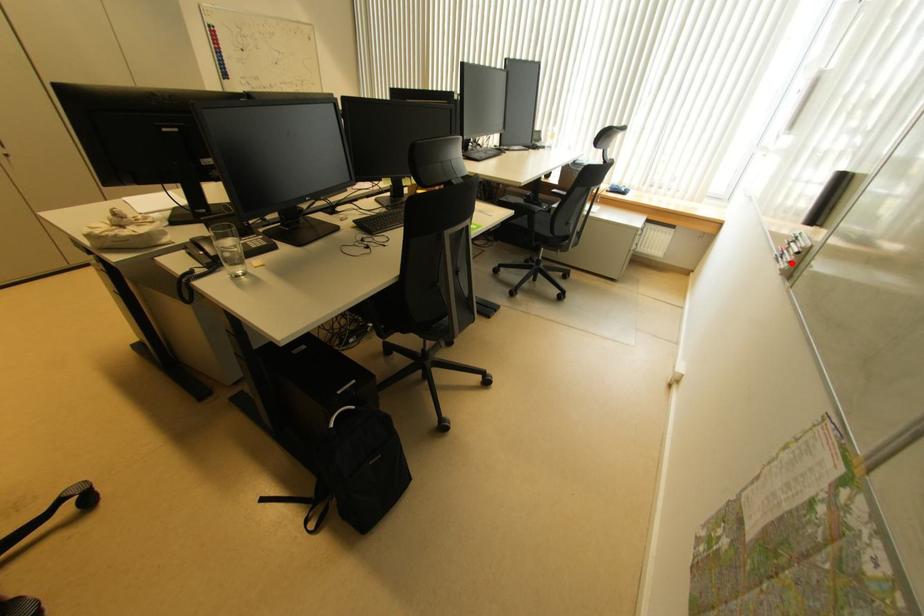
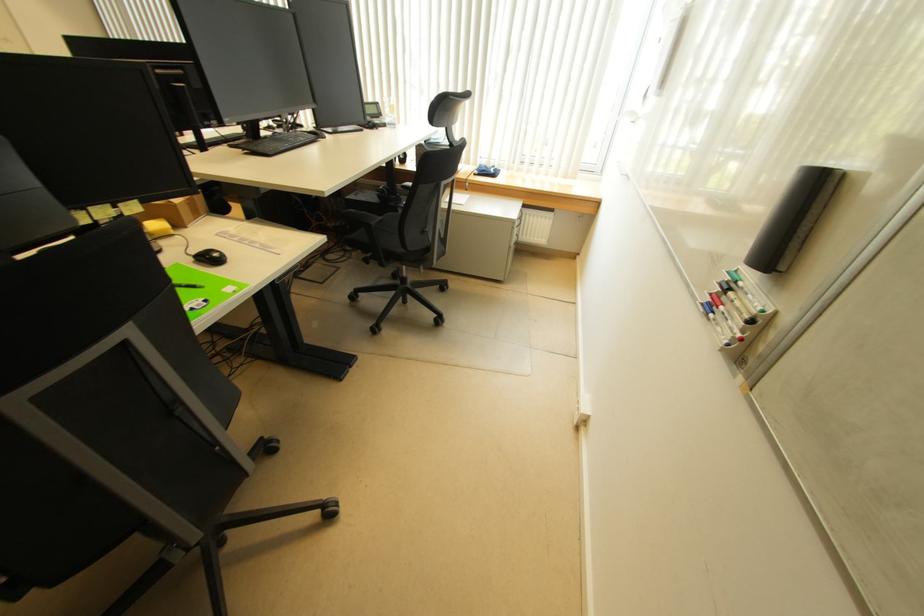
In the second image, find the point that corresponds to the highlighted location in the first image.

(742, 338)